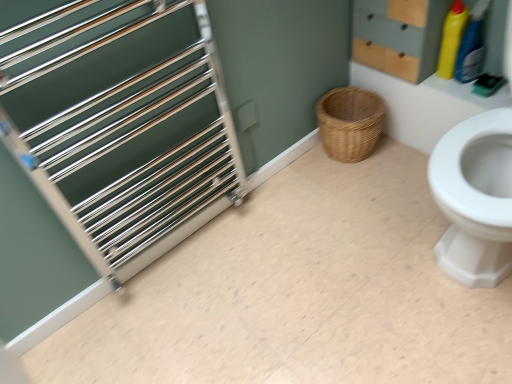
What are the coordinates of `free space that is to the left of yellow plastic bottle at upper right, arranged as the second cleaning product when viewed from the left` in the screenshot? It's located at (432, 81).